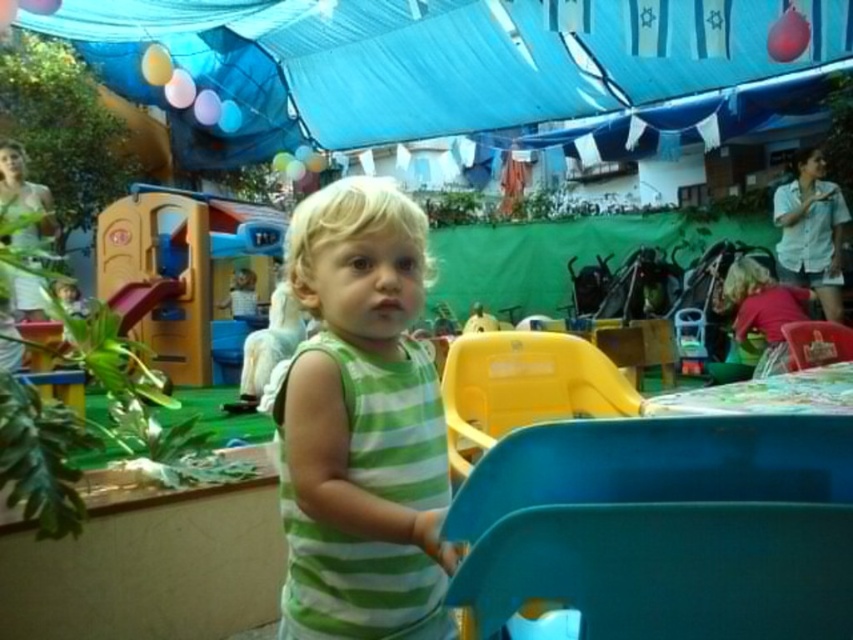
You are planning to set up a temporary shelter using the blue fabric canopy at upper center. Considering the size of the green striped tank top at center, will the canopy provide enough coverage to protect someone wearing it from rain?

The blue fabric canopy at upper center has a larger size compared to the green striped tank top at center, so the canopy should provide sufficient coverage to protect someone wearing the green striped tank top at center from rain.

You are a photographer trying to capture the child in the green striped tank top at center without including the blue fabric canopy at upper center in the frame. Based on their positions, is this possible?

The blue fabric canopy at upper center is positioned on the left side of the green striped tank top at center. Since the canopy is to the left of the tank top, adjusting the camera angle to the right side of the child might exclude the canopy from the frame.

You are standing at the position of point (x=399, y=236) and want to move towards point (x=154, y=24). Is the path clear or blocked?

The path is clear because point (x=154, y=24) is behind point (x=399, y=236), so there are no obstructions between them.